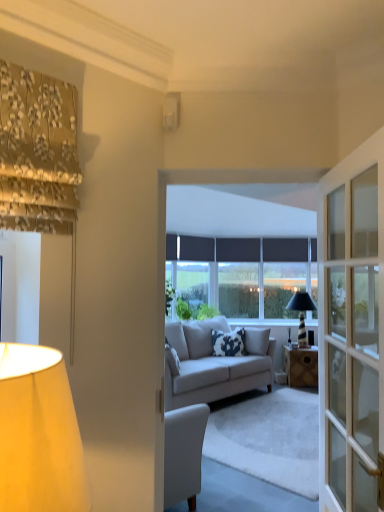
Question: Does white fabric lampshade at left, placed as the third lamp when sorted from right to left, contain white glossy switch at upper center, arranged as the 2th lamp when viewed from the left?

Choices:
 (A) yes
 (B) no

Answer: (B)

Question: Is white fabric lampshade at left, arranged as the 3th lamp when viewed from the back, shorter than white glossy switch at upper center, which is the 2th lamp from front to back?

Choices:
 (A) yes
 (B) no

Answer: (B)

Question: Considering the relative positions of white fabric lampshade at left, marked as the second lamp in a bottom-to-top arrangement, and white glossy switch at upper center, which is the first lamp in top-to-bottom order, in the image provided, is white fabric lampshade at left, marked as the second lamp in a bottom-to-top arrangement, to the right of white glossy switch at upper center, which is the first lamp in top-to-bottom order, from the viewer's perspective?

Choices:
 (A) no
 (B) yes

Answer: (A)

Question: From the image's perspective, is white fabric lampshade at left, arranged as the 3th lamp when viewed from the back, located above white glossy switch at upper center, which is the 2th lamp from front to back?

Choices:
 (A) yes
 (B) no

Answer: (B)

Question: Can we say white fabric lampshade at left, which appears as the first lamp when viewed from the front, lies outside white glossy switch at upper center, arranged as the 2th lamp when viewed from the left?

Choices:
 (A) yes
 (B) no

Answer: (A)

Question: Considering the positions of point (226, 347) and point (302, 327), is point (226, 347) closer or farther from the camera than point (302, 327)?

Choices:
 (A) closer
 (B) farther

Answer: (A)

Question: Looking at their shapes, would you say white cotton pillow at center is wider or thinner than black glass lamp at center, the 1th lamp in the right-to-left sequence?

Choices:
 (A) thin
 (B) wide

Answer: (A)

Question: Is white cotton pillow at center inside or outside of black glass lamp at center, the first lamp ordered from the bottom?

Choices:
 (A) inside
 (B) outside

Answer: (B)

Question: Would you say white cotton pillow at center is to the left or to the right of black glass lamp at center, the 1th lamp in the right-to-left sequence, in the picture?

Choices:
 (A) left
 (B) right

Answer: (A)

Question: In terms of height, does light gray fabric couch at center look taller or shorter compared to matte black window at center?

Choices:
 (A) tall
 (B) short

Answer: (B)

Question: Considering the positions of light gray fabric couch at center and matte black window at center in the image, is light gray fabric couch at center wider or thinner than matte black window at center?

Choices:
 (A) wide
 (B) thin

Answer: (A)

Question: Would you say light gray fabric couch at center is inside or outside matte black window at center?

Choices:
 (A) outside
 (B) inside

Answer: (A)

Question: Considering their positions, is light gray fabric couch at center located in front of or behind matte black window at center?

Choices:
 (A) behind
 (B) front

Answer: (B)

Question: From a real-world perspective, is wooden desk at center physically located above or below matte black window at center?

Choices:
 (A) above
 (B) below

Answer: (B)

Question: Considering the positions of wooden desk at center and matte black window at center in the image, is wooden desk at center wider or thinner than matte black window at center?

Choices:
 (A) thin
 (B) wide

Answer: (B)